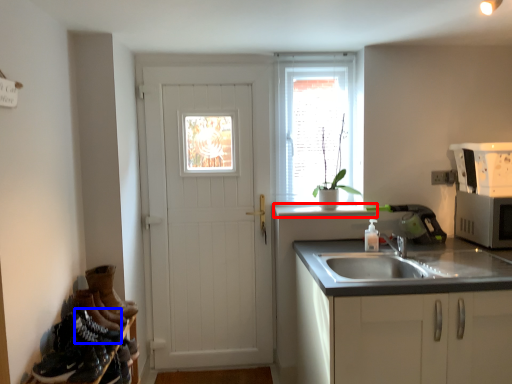
Question: Which object appears farthest to the camera in this image, window sill (highlighted by a red box) or shoe (highlighted by a blue box)?

Choices:
 (A) window sill
 (B) shoe

Answer: (A)